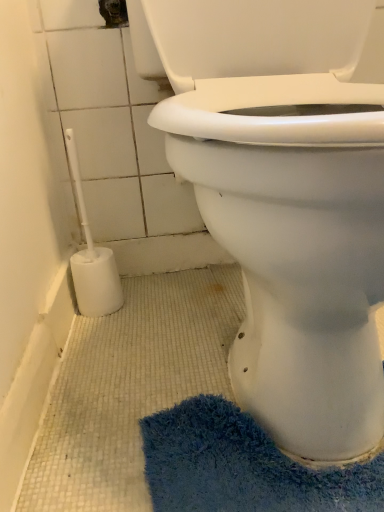
This screenshot has height=512, width=384. What are the coordinates of `blue shaggy bath mat at lower right` in the screenshot? It's located at (243, 466).

Find the location of `white plastic toilet brush at left`. white plastic toilet brush at left is located at coordinates (294, 250).

Is blue shaggy bath mat at lower right facing away from white plastic toilet brush at lower left?

That's not correct — blue shaggy bath mat at lower right is not looking away from white plastic toilet brush at lower left.

Who is taller, blue shaggy bath mat at lower right or white plastic toilet brush at lower left?

With more height is white plastic toilet brush at lower left.

Which object is positioned more to the right, blue shaggy bath mat at lower right or white plastic toilet brush at lower left?

blue shaggy bath mat at lower right.

Is blue shaggy bath mat at lower right spatially inside white plastic toilet brush at lower left, or outside of it?

blue shaggy bath mat at lower right lies outside white plastic toilet brush at lower left.

From the picture: Is white plastic toilet brush at left taller or shorter than blue shaggy bath mat at lower right?

Considering their sizes, white plastic toilet brush at left has more height than blue shaggy bath mat at lower right.

Considering the relative sizes of white plastic toilet brush at left and blue shaggy bath mat at lower right in the image provided, is white plastic toilet brush at left wider than blue shaggy bath mat at lower right?

Yes.

Is white plastic toilet brush at left completely or partially outside of blue shaggy bath mat at lower right?

Yes, white plastic toilet brush at left is located beyond the bounds of blue shaggy bath mat at lower right.

Is white plastic toilet brush at lower left next to white plastic toilet brush at left and touching it?

No, white plastic toilet brush at lower left is not with white plastic toilet brush at left.

Which object is further away from the camera taking this photo, white plastic toilet brush at lower left or white plastic toilet brush at left?

white plastic toilet brush at lower left is further away from the camera.

In the image, there is a white plastic toilet brush at left. Identify the location of brush below it (from a real-world perspective). This screenshot has width=384, height=512. point(92,259).

From a real-world perspective, who is located lower, white plastic toilet brush at lower left or white plastic toilet brush at left?

white plastic toilet brush at lower left is physically lower.

Does white plastic toilet brush at left have a greater height compared to white plastic toilet brush at lower left?

Yes, white plastic toilet brush at left is taller than white plastic toilet brush at lower left.

Which is in front, point (326, 393) or point (106, 283)?

The point (326, 393) is closer to the camera.

Is white plastic toilet brush at left to the right of white plastic toilet brush at lower left from the viewer's perspective?

Yes.

Is white plastic toilet brush at left not close to white plastic toilet brush at lower left?

No, white plastic toilet brush at left is not far away from white plastic toilet brush at lower left.

Based on their sizes in the image, would you say white plastic toilet brush at lower left is bigger or smaller than blue shaggy bath mat at lower right?

white plastic toilet brush at lower left is bigger than blue shaggy bath mat at lower right.

From a real-world perspective, is white plastic toilet brush at lower left located higher than blue shaggy bath mat at lower right?

Yes, from a real-world perspective, white plastic toilet brush at lower left is on top of blue shaggy bath mat at lower right.

Which object is closer to the camera taking this photo, white plastic toilet brush at lower left or blue shaggy bath mat at lower right?

blue shaggy bath mat at lower right.

From the image's perspective, is white plastic toilet brush at lower left positioned above or below blue shaggy bath mat at lower right?

white plastic toilet brush at lower left is situated higher than blue shaggy bath mat at lower right in the image.

Based on their sizes in the image, would you say blue shaggy bath mat at lower right is bigger or smaller than white plastic toilet brush at left?

In the image, blue shaggy bath mat at lower right appears to be smaller than white plastic toilet brush at left.

Consider the image. Choose the correct answer: Is blue shaggy bath mat at lower right inside white plastic toilet brush at left or outside it?

blue shaggy bath mat at lower right is located inside white plastic toilet brush at left.

Is blue shaggy bath mat at lower right with white plastic toilet brush at left?

No, blue shaggy bath mat at lower right is not in contact with white plastic toilet brush at left.

Where is `bath mat behind the white plastic toilet brush at left`? This screenshot has width=384, height=512. bath mat behind the white plastic toilet brush at left is located at coordinates (243, 466).

Where is `bath mat on the right of the white plastic toilet brush at lower left`? The height and width of the screenshot is (512, 384). bath mat on the right of the white plastic toilet brush at lower left is located at coordinates (243, 466).

Where is `bath mat below the white plastic toilet brush at left (from the image's perspective)`? bath mat below the white plastic toilet brush at left (from the image's perspective) is located at coordinates (243, 466).

Looking at the image, which one is located closer to white plastic toilet brush at lower left, blue shaggy bath mat at lower right or white plastic toilet brush at left?

blue shaggy bath mat at lower right.

Looking at the image, which one is located further to white plastic toilet brush at left, blue shaggy bath mat at lower right or white plastic toilet brush at lower left?

The object further to white plastic toilet brush at left is white plastic toilet brush at lower left.

Considering their positions, is white plastic toilet brush at lower left positioned closer to white plastic toilet brush at left than blue shaggy bath mat at lower right?

Among the two, blue shaggy bath mat at lower right is located nearer to white plastic toilet brush at left.

Estimate the real-world distances between objects in this image. Which object is closer to white plastic toilet brush at lower left, white plastic toilet brush at left or blue shaggy bath mat at lower right?

blue shaggy bath mat at lower right is positioned closer to the anchor white plastic toilet brush at lower left.

Looking at the image, which one is located closer to blue shaggy bath mat at lower right, white plastic toilet brush at lower left or white plastic toilet brush at left?

Based on the image, white plastic toilet brush at left appears to be nearer to blue shaggy bath mat at lower right.

Looking at the image, which one is located closer to blue shaggy bath mat at lower right, white plastic toilet brush at left or white plastic toilet brush at lower left?

white plastic toilet brush at left is positioned closer to the anchor blue shaggy bath mat at lower right.

Locate an element on the screen. bath mat located between white plastic toilet brush at left and white plastic toilet brush at lower left in the depth direction is located at coordinates (243, 466).